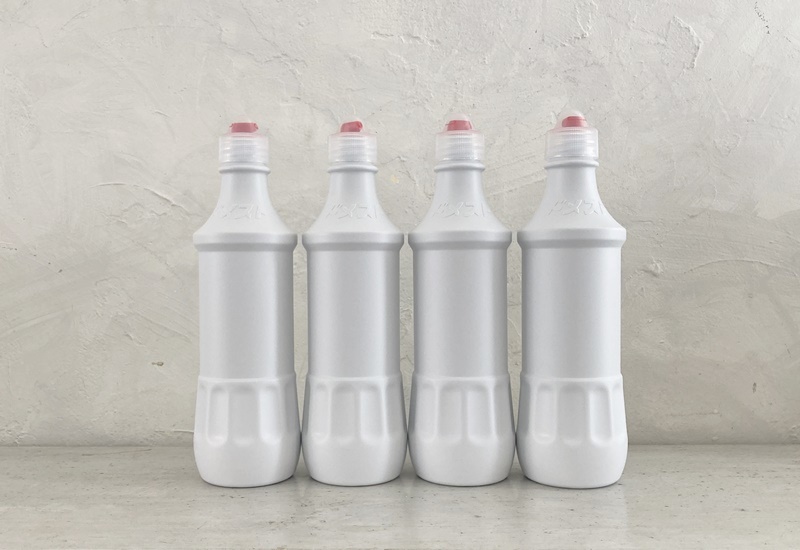
Where is `bottles next to another bottle`? The image size is (800, 550). bottles next to another bottle is located at coordinates (253, 340), (330, 305), (474, 285), (577, 274).